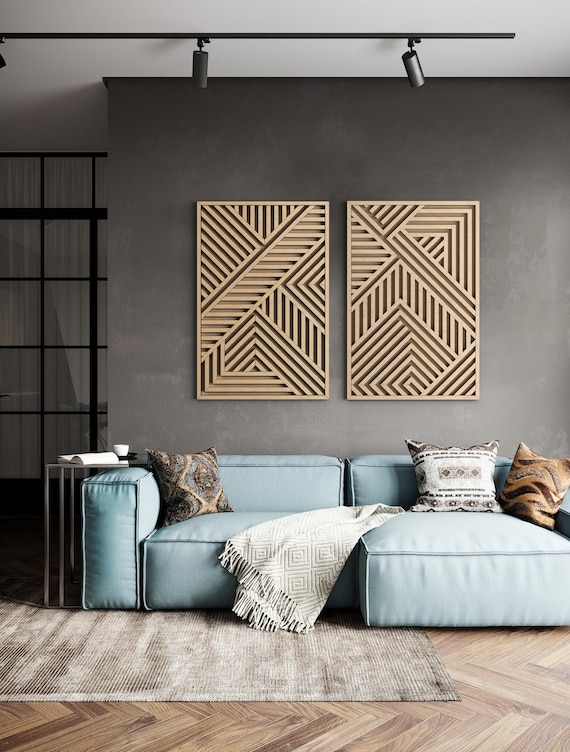
What are the coordinates of `modular seats` in the screenshot? It's located at (410, 546), (243, 528).